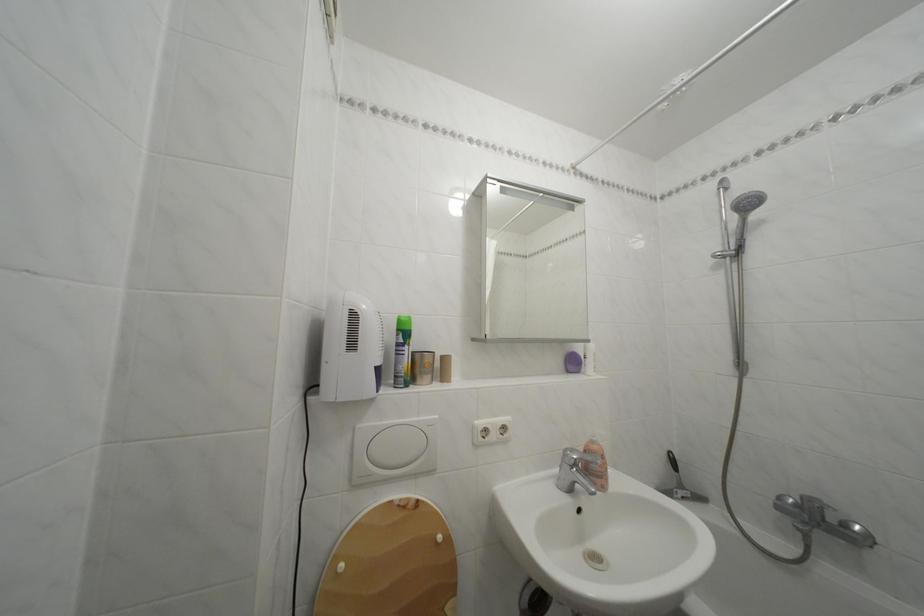
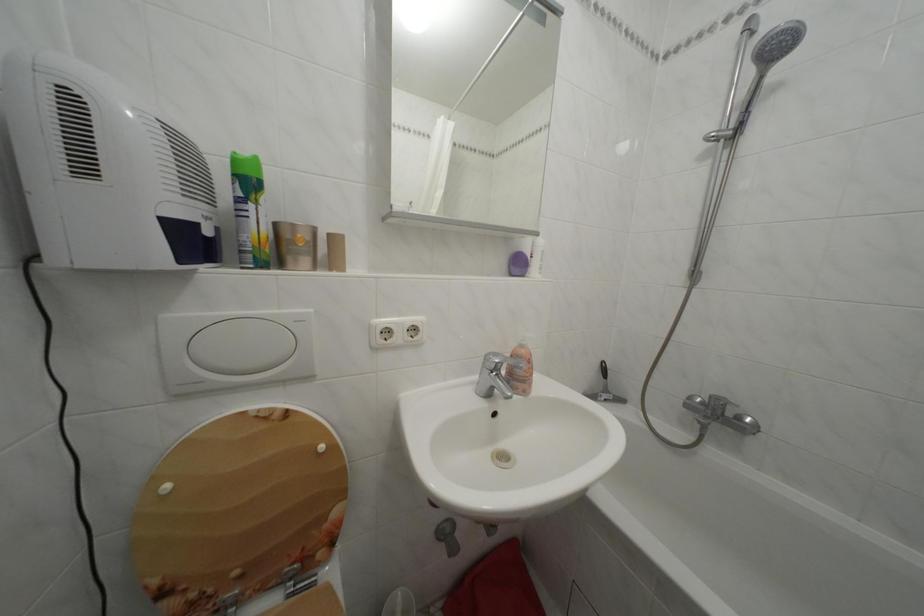
In the second image, find the point that corresponds to point 689,492 in the first image.

(614, 397)